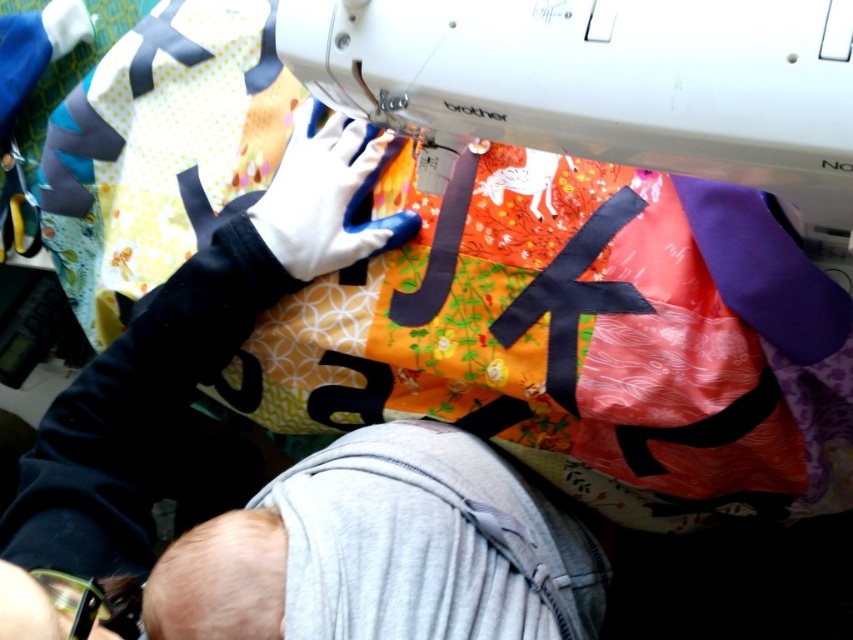
Question: Which point is closer to the camera?

Choices:
 (A) white plastic sewing machine at upper center
 (B) gray soft baby at lower center

Answer: (A)

Question: Which point is closer to the camera taking this photo?

Choices:
 (A) (447, 634)
 (B) (770, 157)

Answer: (B)

Question: Is white plastic sewing machine at upper center further to the viewer compared to gray soft baby at lower center?

Choices:
 (A) no
 (B) yes

Answer: (A)

Question: Can you confirm if white plastic sewing machine at upper center is positioned to the right of gray soft baby at lower center?

Choices:
 (A) yes
 (B) no

Answer: (A)

Question: Which of the following is the farthest from the observer?

Choices:
 (A) gray soft baby at lower center
 (B) white plastic sewing machine at upper center

Answer: (A)

Question: Is white plastic sewing machine at upper center to the left of gray soft baby at lower center from the viewer's perspective?

Choices:
 (A) yes
 (B) no

Answer: (B)